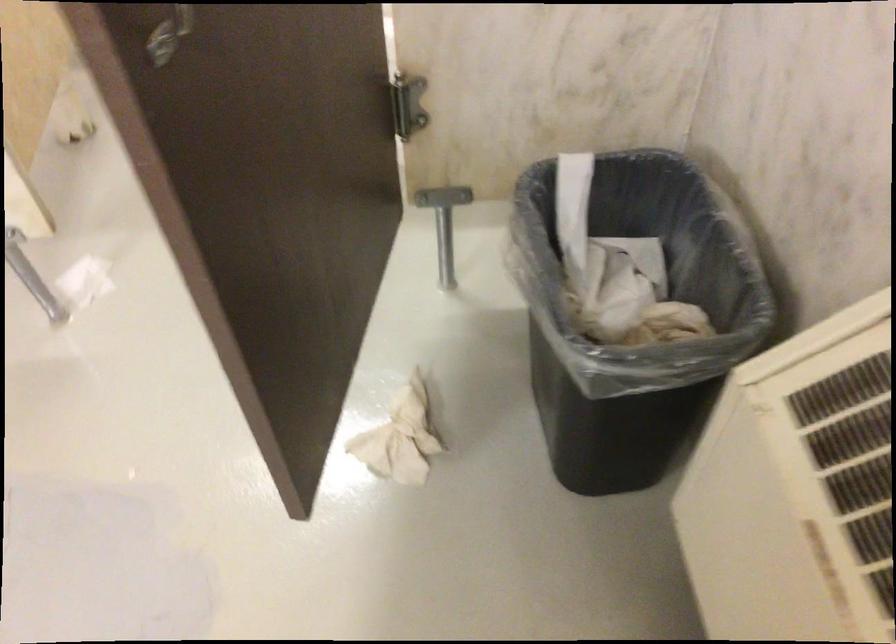
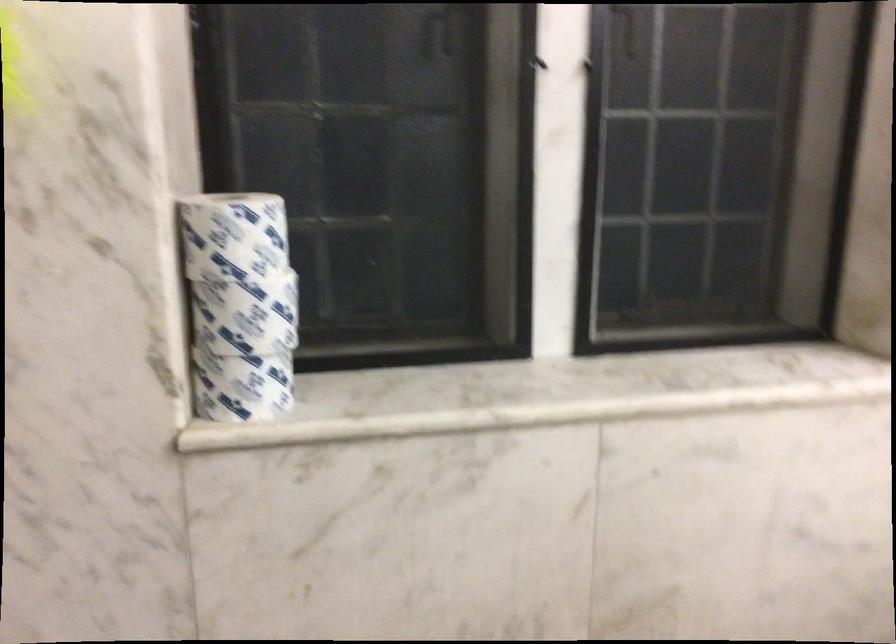
Question: The first image is from the beginning of the video and the second image is from the end. How did the camera likely rotate when shooting the video?

Choices:
 (A) Left
 (B) Right
 (C) Up
 (D) Down

Answer: (B)